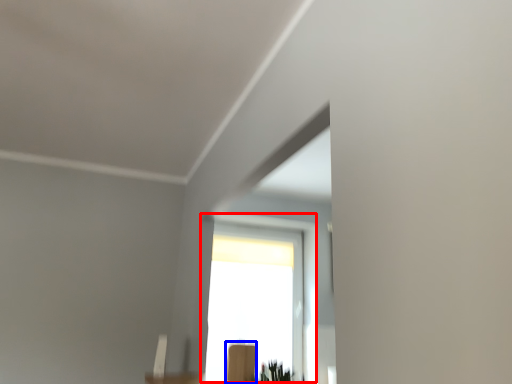
Question: Which object is closer to the camera taking this photo, window (highlighted by a red box) or furniture (highlighted by a blue box)?

Choices:
 (A) window
 (B) furniture

Answer: (B)